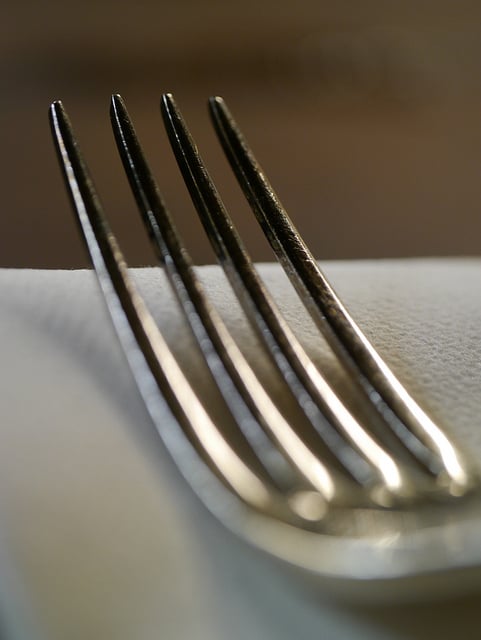
Identify the location of fork. (395, 553).